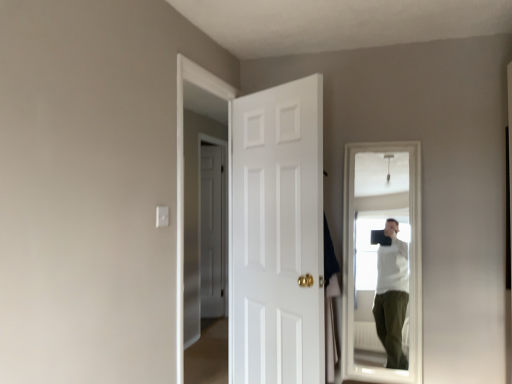
Question: From the image's perspective, is white matte door at center, which is counted as the second door, starting from the right, positioned above or below white painted wood door at center, which is counted as the first door, starting from the front?

Choices:
 (A) below
 (B) above

Answer: (A)

Question: From a real-world perspective, relative to white painted wood door at center, the 2th door in the left-to-right sequence, is white matte door at center, the 1th door viewed from the left, vertically above or below?

Choices:
 (A) below
 (B) above

Answer: (A)

Question: Considering the relative positions of white matte door at center, the 2th door when ordered from front to back, and white painted wood door at center, the 2th door in the left-to-right sequence, in the image provided, is white matte door at center, the 2th door when ordered from front to back, to the left or to the right of white painted wood door at center, the 2th door in the left-to-right sequence,?

Choices:
 (A) left
 (B) right

Answer: (A)

Question: Choose the correct answer: Is white painted wood door at center, which is the 2th door in back-to-front order, inside white matte door at center, which is counted as the second door, starting from the right, or outside it?

Choices:
 (A) outside
 (B) inside

Answer: (A)

Question: In terms of height, does white painted wood door at center, the 2th door in the left-to-right sequence, look taller or shorter compared to white matte door at center, the 2th door when ordered from front to back?

Choices:
 (A) tall
 (B) short

Answer: (B)

Question: From a real-world perspective, is white painted wood door at center, which is the 1th door from right to left, physically located above or below white matte door at center, which ranks as the first door in back-to-front order?

Choices:
 (A) below
 (B) above

Answer: (B)

Question: Is white painted wood door at center, the 2th door in the left-to-right sequence, wider or thinner than white matte door at center, the 1th door viewed from the left?

Choices:
 (A) wide
 (B) thin

Answer: (A)